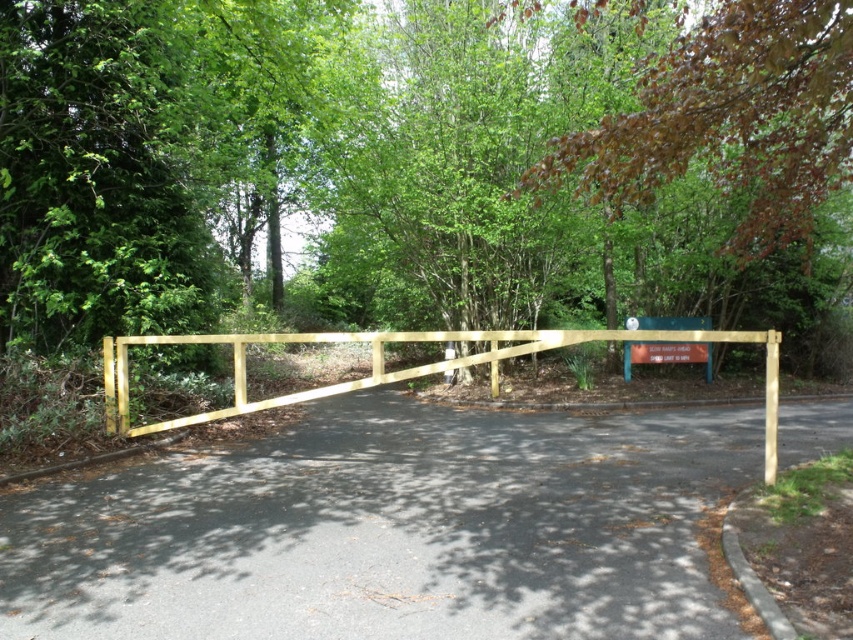
Looking at this image, you are standing at the wooden gate and looking towards the forest. There is a brown leafy tree at upper right located at point (730, 118). Can you see the tree from your current position?

Yes, the brown leafy tree at upper right is located at point (730, 118), which is within your line of sight from the wooden gate.

You are standing at the entrance of the forest and see the yellow wooden fence at center. If you walk straight ahead, will you eventually reach the forest trees in the background?

Yes, walking straight ahead from the yellow wooden fence at center will lead you towards the forest trees in the background since the fence is positioned at the entrance of the forest.

You are standing at the entrance of the forest and see the yellow wooden fence at center. If you were to walk directly towards the fence, which direction would you need to move relative to your current position?

Since the yellow wooden fence at center is located at point 0.830 on the x axis and 0.458 on the y axis, you would need to move forward towards the center to reach it.